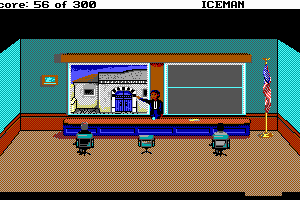
This screenshot has width=300, height=200. I want to click on blue walls, so click(x=187, y=42), click(x=292, y=85), click(x=5, y=89).